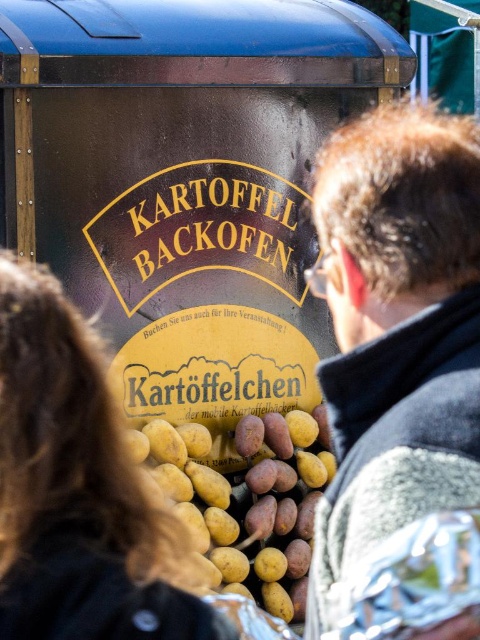
Between point (362, 460) and point (144, 456), which one is positioned in front?

Point (362, 460) is more forward.

Is point (368, 348) positioned before point (295, 429)?

Yes.

You are a GUI agent. You are given a task and a screenshot of the screen. Output one action in this format:
    pyautogui.click(x=<x>, y=<y>)
    Task: Click on the gray woolen jacket at center
    The width and height of the screenshot is (480, 640).
    Given the screenshot: What is the action you would take?
    pyautogui.click(x=396, y=330)

Between point (452, 134) and point (37, 307), which one is positioned in front?

Positioned in front is point (37, 307).

Can you confirm if gray woolen jacket at center is thinner than blonde hair at center?

In fact, gray woolen jacket at center might be wider than blonde hair at center.

Locate an element on the screen. The height and width of the screenshot is (640, 480). gray woolen jacket at center is located at coordinates [x=396, y=330].

Does blonde hair at center have a smaller size compared to yellow matte potatoes at center?

Yes, blonde hair at center is smaller than yellow matte potatoes at center.

Does point (81, 470) come closer to viewer compared to point (269, 451)?

Yes.

Between point (17, 564) and point (272, 444), which one is positioned behind?

Positioned behind is point (272, 444).

This screenshot has width=480, height=640. Find the location of `blonde hair at center`. blonde hair at center is located at coordinates (73, 486).